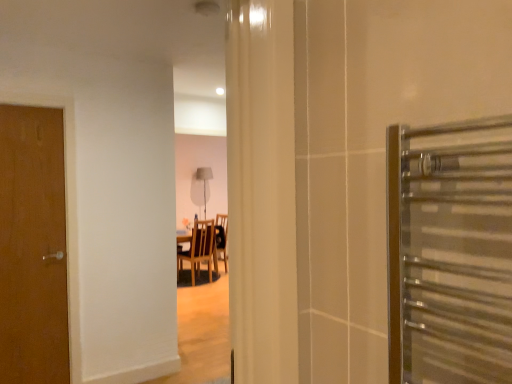
Describe the element at coordinates (199, 251) in the screenshot. This screenshot has width=512, height=384. I see `wooden chair at center` at that location.

Measure the distance between wooden chair at center and camera.

21.12 feet.

Find the location of `wooden chair at center`. wooden chair at center is located at coordinates (199, 251).

The height and width of the screenshot is (384, 512). I want to click on brown wood door at left, so click(x=33, y=247).

What do you see at coordinates (33, 247) in the screenshot? I see `brown wood door at left` at bounding box center [33, 247].

Where is `wooden chair at center`? wooden chair at center is located at coordinates (199, 251).

Can you confirm if brown wood door at left is positioned to the right of wooden chair at center?

No.

In the scene shown: Considering the positions of objects brown wood door at left and wooden chair at center in the image provided, who is in front, brown wood door at left or wooden chair at center?

brown wood door at left is in front.

Considering the positions of points (49, 137) and (196, 225), is point (49, 137) farther from camera compared to point (196, 225)?

No, it is in front of (196, 225).

From the image's perspective, is brown wood door at left below wooden chair at center?

Actually, brown wood door at left appears above wooden chair at center in the image.

From a real-world perspective, who is located higher, brown wood door at left or wooden chair at center?

From a 3D spatial view, brown wood door at left is above.

Considering the relative sizes of brown wood door at left and wooden chair at center in the image provided, is brown wood door at left wider than wooden chair at center?

No.

Is brown wood door at left shorter than wooden chair at center?

Incorrect, the height of brown wood door at left does not fall short of that of wooden chair at center.

Which of these two, brown wood door at left or wooden chair at center, is bigger?

wooden chair at center.

Is brown wood door at left situated inside wooden chair at center or outside?

brown wood door at left is outside wooden chair at center.

Are brown wood door at left and wooden chair at center beside each other?

No, brown wood door at left is not with wooden chair at center.

Looking at this image, is brown wood door at left oriented towards wooden chair at center?

No, brown wood door at left is not aimed at wooden chair at center.

What's the angular difference between brown wood door at left and wooden chair at center's facing directions?

180 degrees separate the facing orientations of brown wood door at left and wooden chair at center.

Locate an element on the screen. chair below the brown wood door at left (from the image's perspective) is located at coordinates (199, 251).

Between wooden chair at center and brown wood door at left, which one appears on the left side from the viewer's perspective?

brown wood door at left is more to the left.

Considering the relative positions of wooden chair at center and brown wood door at left in the image provided, is wooden chair at center behind brown wood door at left?

That is True.

Which is in front, point (197, 220) or point (10, 247)?

The point (10, 247) is closer to the camera.

From the image's perspective, does wooden chair at center appear higher than brown wood door at left?

Incorrect, from the image's perspective, wooden chair at center is lower than brown wood door at left.

From a real-world perspective, between wooden chair at center and brown wood door at left, who is vertically higher?

In real-world perspective, brown wood door at left is above.

Which object is wider, wooden chair at center or brown wood door at left?

wooden chair at center is wider.

Between wooden chair at center and brown wood door at left, which one has less height?

wooden chair at center is shorter.

Considering the sizes of wooden chair at center and brown wood door at left in the image, is wooden chair at center bigger or smaller than brown wood door at left?

Considering their sizes, wooden chair at center takes up more space than brown wood door at left.

From the picture: Is wooden chair at center surrounding brown wood door at left?

No, brown wood door at left is not surrounded by wooden chair at center.

Would you say wooden chair at center is a long distance from brown wood door at left?

Yes.

Looking at this image, is wooden chair at center looking in the opposite direction of brown wood door at left?

No, wooden chair at center's orientation is not away from brown wood door at left.

Where is `chair below the brown wood door at left (from the image's perspective)`? chair below the brown wood door at left (from the image's perspective) is located at coordinates [199, 251].

I want to click on door above the wooden chair at center (from a real-world perspective), so click(x=33, y=247).

This screenshot has height=384, width=512. What are the coordinates of `door above the wooden chair at center (from the image's perspective)` in the screenshot? It's located at (33, 247).